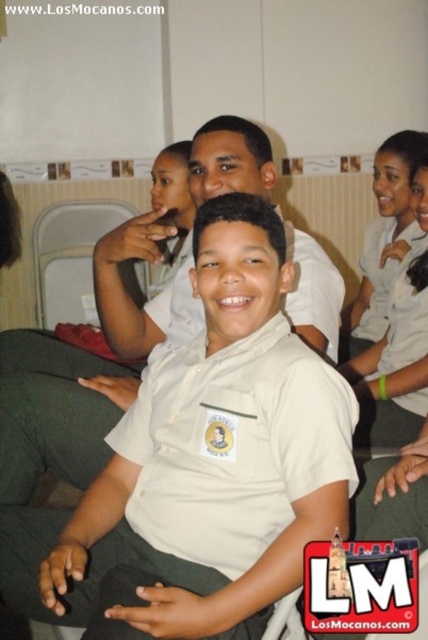
You are a photographer trying to capture the boy in the lightest area of the room. According to the image, where should you position yourself relative to the point labeled as point (222,444)?

The white uniform shirt at center is located at point (222,444). Since the photographer wants the lightest area, they should position themselves near this point as the white shirt reflects more light.

You are standing in the classroom and need to locate the white uniform shirt at center. According to the coordinates provided, where exactly is it positioned?

The white uniform shirt at center is located at point 0.695 on the x axis and 0.521 on the y axis.

Consider the image. You are a photographer trying to capture a clear shot of the white uniform shirt at center and the white matte uniform at center. Which one should you focus on first if you want to ensure the larger object is in sharp focus?

The white uniform shirt at center should be focused on first because it has a larger size compared to the white matte uniform at center, ensuring the bigger object is in sharp focus.